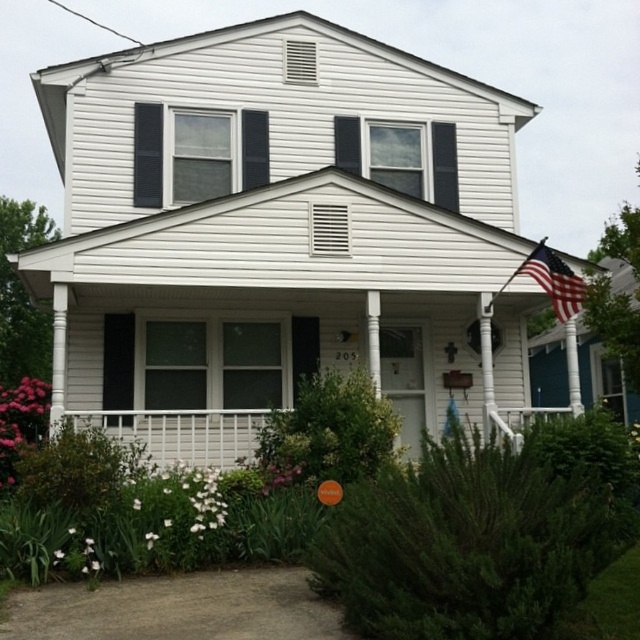
From the picture: Does american flag at upper right have a greater height compared to white matte flower at center?

Yes, american flag at upper right is taller than white matte flower at center.

Does american flag at upper right appear on the left side of white matte flower at center?

No, american flag at upper right is not to the left of white matte flower at center.

Does point (547, 272) come in front of point (92, 541)?

That is False.

In order to click on american flag at upper right in this screenshot , I will do tap(554, 280).

Is pink matte flower at lower left below american flag at upper right?

Yes.

Can you confirm if pink matte flower at lower left is thinner than american flag at upper right?

Yes, pink matte flower at lower left is thinner than american flag at upper right.

Is point (38, 403) more distant than point (540, 276)?

Yes.

Find the location of `pink matte flower at lower left`. pink matte flower at lower left is located at coordinates (20, 420).

Is pink matte flower at lower left wider than white matte flower at center?

Yes.

Does pink matte flower at lower left have a smaller size compared to white matte flower at center?

Actually, pink matte flower at lower left might be larger than white matte flower at center.

Who is more distant from viewer, [16,456] or [92,540]?

The point [16,456] is more distant.

You are a GUI agent. You are given a task and a screenshot of the screen. Output one action in this format:
    pyautogui.click(x=<x>, y=<y>)
    Task: Click on the pink matte flower at lower left
    This screenshot has height=640, width=640.
    Given the screenshot: What is the action you would take?
    pyautogui.click(x=20, y=420)